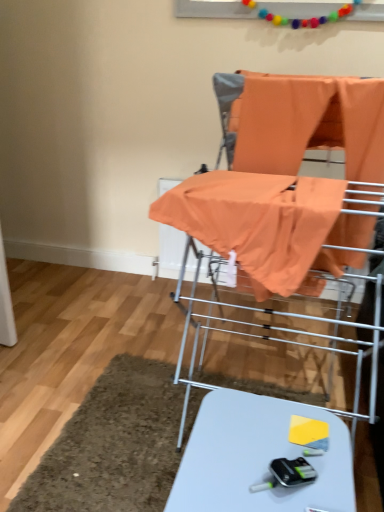
Question: Should I look upward or downward to see white glossy table at lower center?

Choices:
 (A) down
 (B) up

Answer: (A)

Question: Is white glossy table at lower center positioned with its back to orange fabric at center?

Choices:
 (A) no
 (B) yes

Answer: (A)

Question: Considering the relative sizes of white glossy table at lower center and orange fabric at center in the image provided, is white glossy table at lower center thinner than orange fabric at center?

Choices:
 (A) yes
 (B) no

Answer: (A)

Question: From the image's perspective, would you say white glossy table at lower center is shown under orange fabric at center?

Choices:
 (A) yes
 (B) no

Answer: (A)

Question: Is white glossy table at lower center to the left of orange fabric at center from the viewer's perspective?

Choices:
 (A) yes
 (B) no

Answer: (A)

Question: Does white glossy table at lower center have a lesser height compared to orange fabric at center?

Choices:
 (A) no
 (B) yes

Answer: (B)

Question: Is white glossy table at lower center at the right side of orange fabric at center?

Choices:
 (A) yes
 (B) no

Answer: (B)

Question: Is orange fabric baby carriage at center located within white glossy table at lower center?

Choices:
 (A) no
 (B) yes

Answer: (A)

Question: From a real-world perspective, is white glossy table at lower center on orange fabric baby carriage at center?

Choices:
 (A) yes
 (B) no

Answer: (B)

Question: Is white glossy table at lower center far from orange fabric baby carriage at center?

Choices:
 (A) no
 (B) yes

Answer: (A)

Question: From a real-world perspective, does white glossy table at lower center sit lower than orange fabric baby carriage at center?

Choices:
 (A) no
 (B) yes

Answer: (B)

Question: Does white glossy table at lower center have a greater width compared to orange fabric baby carriage at center?

Choices:
 (A) no
 (B) yes

Answer: (A)

Question: Does white glossy table at lower center have a lesser height compared to orange fabric baby carriage at center?

Choices:
 (A) yes
 (B) no

Answer: (A)

Question: Does orange fabric baby carriage at center have a lesser width compared to orange fabric at center?

Choices:
 (A) no
 (B) yes

Answer: (A)